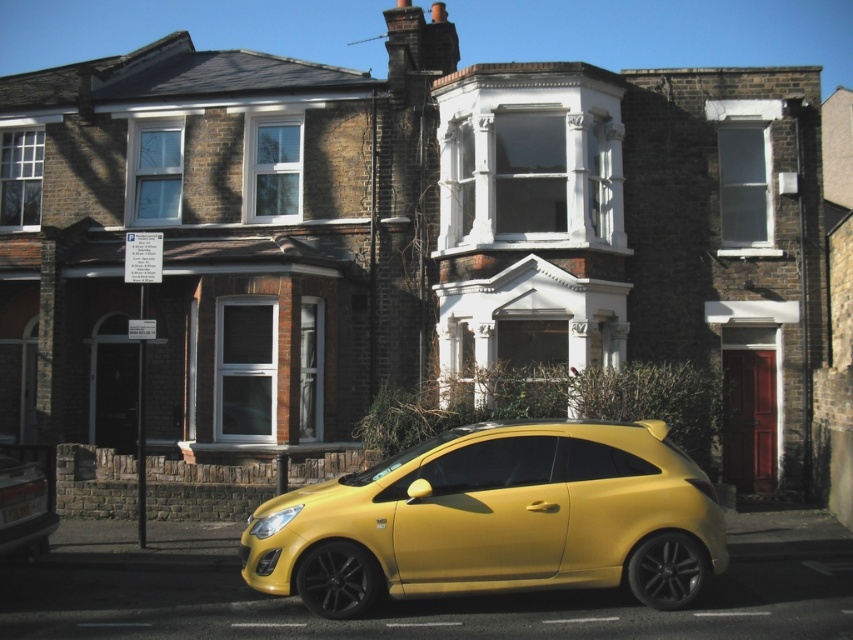
Question: Which point appears farthest from the camera in this image?

Choices:
 (A) pyautogui.click(x=285, y=525)
 (B) pyautogui.click(x=39, y=547)
 (C) pyautogui.click(x=13, y=502)

Answer: (B)

Question: Does yellow matte car at lower center lie behind yellow plastic license plate at lower left?

Choices:
 (A) no
 (B) yes

Answer: (A)

Question: Which point is closer to the camera?

Choices:
 (A) yellow matte car at lower center
 (B) metallic yellow hatchback at lower left

Answer: (A)

Question: Which point appears farthest from the camera in this image?

Choices:
 (A) (18, 512)
 (B) (48, 467)
 (C) (244, 564)

Answer: (B)

Question: Considering the relative positions of metallic yellow hatchback at lower left and yellow plastic license plate at lower left in the image provided, where is metallic yellow hatchback at lower left located with respect to yellow plastic license plate at lower left?

Choices:
 (A) below
 (B) above

Answer: (B)

Question: Can you confirm if metallic yellow hatchback at lower left is positioned to the left of yellow plastic license plate at lower left?

Choices:
 (A) no
 (B) yes

Answer: (B)